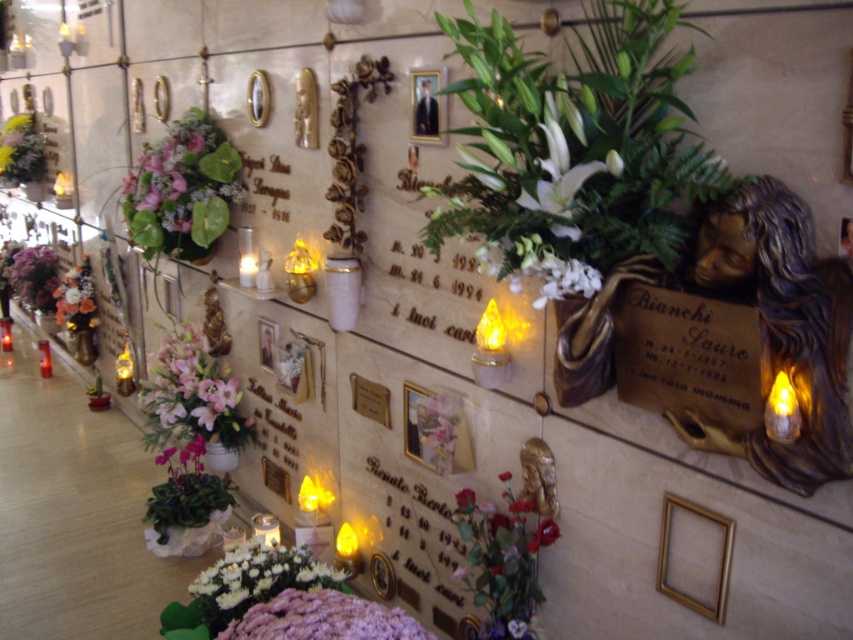
Question: Does purple fabric bouquet at lower center appear on the right side of white matte flowers at center?

Choices:
 (A) no
 (B) yes

Answer: (A)

Question: Can you confirm if green leafy plant at left is wider than metallic gold picture frame at upper center?

Choices:
 (A) no
 (B) yes

Answer: (B)

Question: Does white matte flowers at lower center have a larger size compared to white matte flowers at center?

Choices:
 (A) yes
 (B) no

Answer: (A)

Question: Estimate the real-world distances between objects in this image. Which object is closer to the gold metallic picture frame at center?

Choices:
 (A) white matte flowers at lower center
 (B) metallic gold picture frame at upper center
 (C) bronze plaque at center right
 (D) green leafy plant at left

Answer: (A)

Question: Which point appears farthest from the camera in this image?

Choices:
 (A) (204, 589)
 (B) (735, 364)
 (C) (270, 362)

Answer: (C)

Question: Which of the following is the closest to the observer?

Choices:
 (A) white matte flowers at center
 (B) pink silk flowers at lower left
 (C) gold metallic picture frame at center
 (D) gold metallic picture frame at center right

Answer: (A)